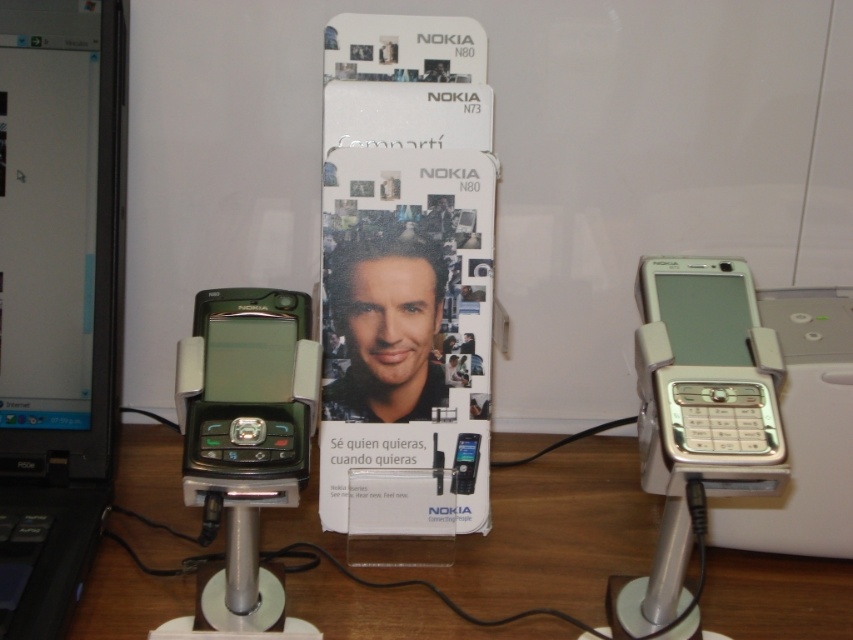
You are setting up a tech exhibit and need to arrange items on a table. You have a black plastic laptop at left and a matte black phone at center. From the visitor perspective, which item is closer to them?

The black plastic laptop at left is closer to the visitor because it is in front of the matte black phone at center.

You are setting up a small electronics display. You have a metallic green phone at left and a wooden table at center. Which object should you place first if you want to ensure there is enough space for both items?

You should place the wooden table at center first because it might be wider than the metallic green phone at left, so positioning it first ensures there is enough space for both items.